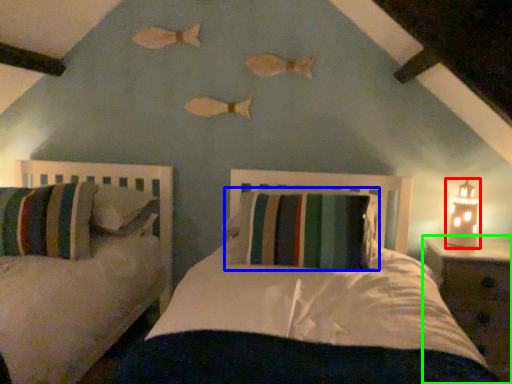
Question: Based on their relative distances, which object is nearer to table lamp (highlighted by a red box)? Choose from pillow (highlighted by a blue box) and nightstand (highlighted by a green box).

Choices:
 (A) pillow
 (B) nightstand

Answer: (B)